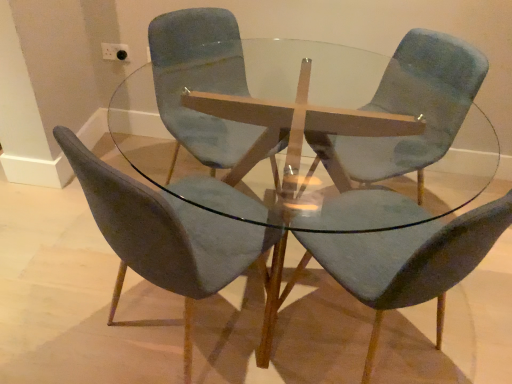
Question: Does point (418, 48) appear closer or farther from the camera than point (391, 147)?

Choices:
 (A) closer
 (B) farther

Answer: (B)

Question: Considering the positions of velvet blue chair at center, which is the fourth chair in left-to-right order, and transparent glass table at center in the image, is velvet blue chair at center, which is the fourth chair in left-to-right order, wider or thinner than transparent glass table at center?

Choices:
 (A) wide
 (B) thin

Answer: (B)

Question: Based on their relative distances, which object is nearer to the velvet blue chair at center, which appears as the 3th chair when viewed from the right?

Choices:
 (A) velvet blue chair at center, which is the 2th chair in right-to-left order
 (B) transparent glass table at center
 (C) velvet blue chair at center, positioned as the first chair in right-to-left order
 (D) velvet blue chair at center, the first chair positioned from the left

Answer: (D)

Question: Considering the real-world distances, which object is closest to the velvet blue chair at center, which is the 2th chair in right-to-left order?

Choices:
 (A) transparent glass table at center
 (B) velvet blue chair at center, which appears as the 3th chair when viewed from the right
 (C) velvet blue chair at center, which is the fourth chair in left-to-right order
 (D) velvet blue chair at center, which is counted as the 4th chair, starting from the right

Answer: (A)